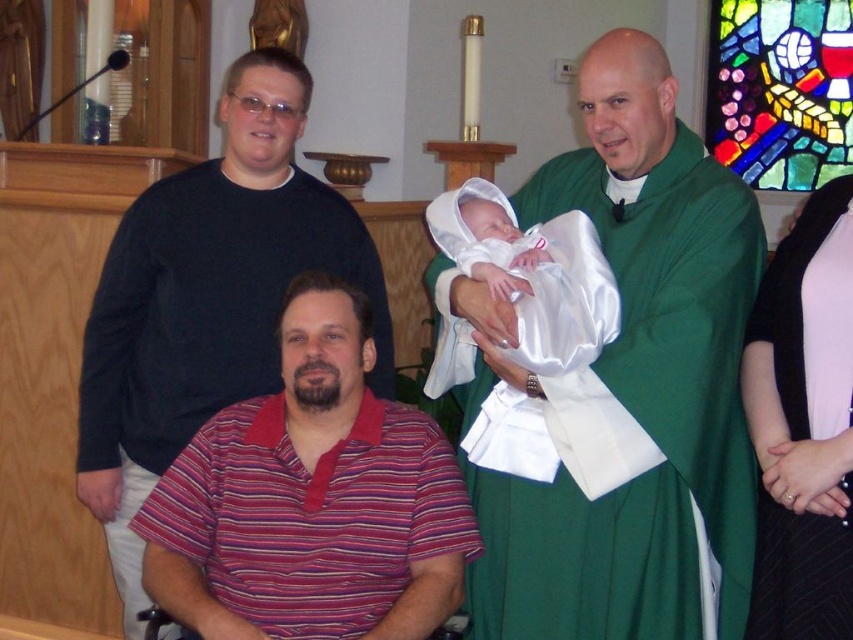
The image size is (853, 640). What do you see at coordinates (311, 499) in the screenshot?
I see `striped polo shirt at lower left` at bounding box center [311, 499].

Is striped polo shirt at lower left to the right of black matte shirt at upper left from the viewer's perspective?

Yes, striped polo shirt at lower left is to the right of black matte shirt at upper left.

The image size is (853, 640). What do you see at coordinates (311, 499) in the screenshot? I see `striped polo shirt at lower left` at bounding box center [311, 499].

Locate an element on the screen. Image resolution: width=853 pixels, height=640 pixels. striped polo shirt at lower left is located at coordinates (311, 499).

You are a GUI agent. You are given a task and a screenshot of the screen. Output one action in this format:
    pyautogui.click(x=<x>, y=<y>)
    Task: Click on the striped polo shirt at lower left
    
    Given the screenshot: What is the action you would take?
    pyautogui.click(x=311, y=499)

Which is below, striped polo shirt at lower left or pink satin dress at right?

striped polo shirt at lower left is below.

Identify the location of striped polo shirt at lower left. Image resolution: width=853 pixels, height=640 pixels. (311, 499).

Does green satin robe at center appear on the left side of striped polo shirt at lower left?

In fact, green satin robe at center is to the right of striped polo shirt at lower left.

Where is `green satin robe at center`? This screenshot has width=853, height=640. green satin robe at center is located at coordinates (625, 385).